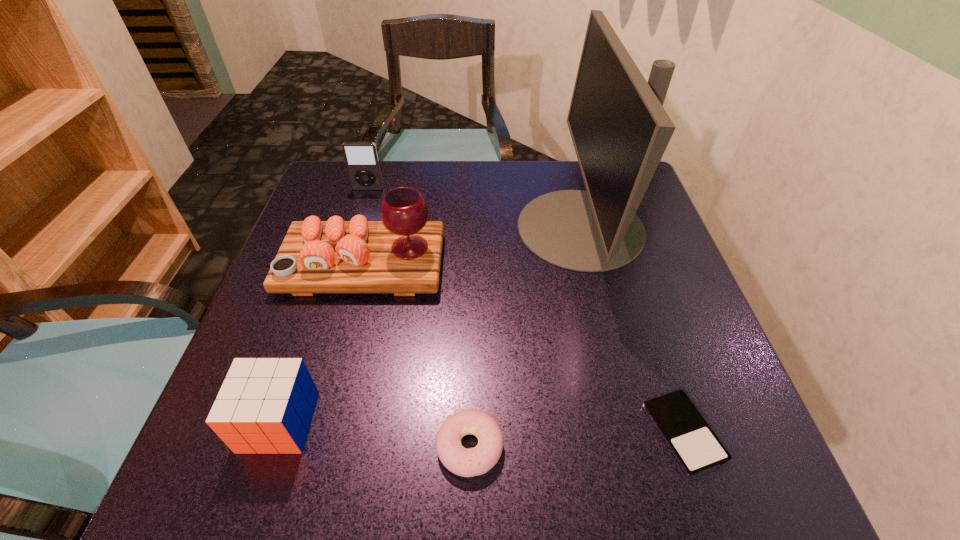
I want to click on free space between the third tallest object and the tallest object, so click(474, 208).

Locate an element on the screen. empty space that is in between the computer monitor and the fourth shortest object is located at coordinates (474, 208).

The height and width of the screenshot is (540, 960). Identify the location of vacant area that lies between the third object from right to left and the cube. (374, 434).

Locate an element on the screen. The width and height of the screenshot is (960, 540). empty space between the fourth object from left to right and the cube is located at coordinates (374, 434).

This screenshot has width=960, height=540. Identify the location of object that is the fifth nearest to the cube. (361, 158).

Identify the location of the fifth closest object relative to the computer monitor. (265, 405).

This screenshot has width=960, height=540. What are the coordinates of `free space that satisfies the following two spatial constraints: 1. on the screen of the computer monitor; 2. on the back side of the shorter iPod` in the screenshot? It's located at (631, 433).

Identify the location of free region that satisfies the following two spatial constraints: 1. on the screen of the tallest object; 2. on the front side of the doughnut. The image size is (960, 540). (635, 447).